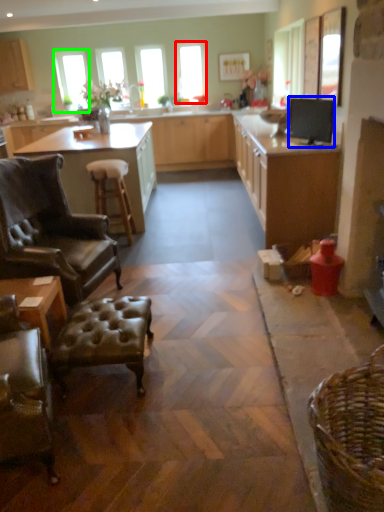
Question: Estimate the real-world distances between objects in this image. Which object is closer to window (highlighted by a red box), appliance (highlighted by a blue box) or window (highlighted by a green box)?

Choices:
 (A) appliance
 (B) window

Answer: (B)